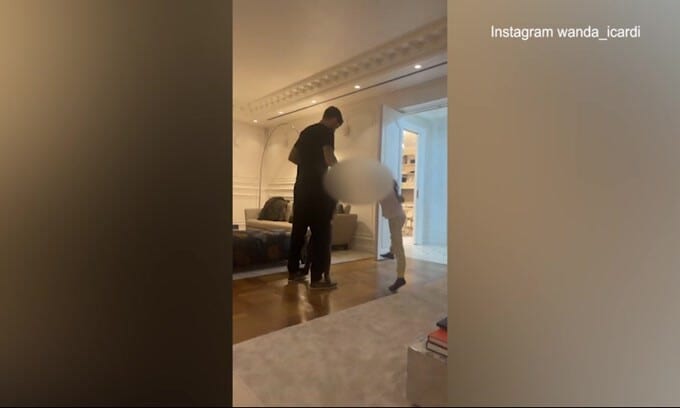
Identify the location of light. (313, 101).